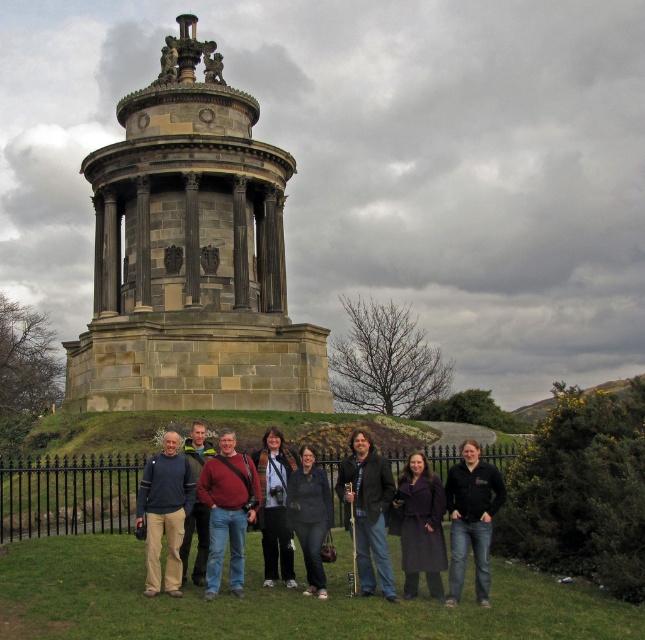
Is dark blue sweater at center taller than knitted sweater at center?

Indeed, dark blue sweater at center has a greater height compared to knitted sweater at center.

Between point (208, 536) and point (203, 468), which one is positioned behind?

The point (203, 468) is more distant.

The height and width of the screenshot is (640, 645). I want to click on dark blue sweater at center, so click(263, 502).

Is brown stone tower at center to the left of dark blue sweater at center from the viewer's perspective?

Indeed, brown stone tower at center is positioned on the left side of dark blue sweater at center.

Can you confirm if brown stone tower at center is positioned above dark blue sweater at center?

Yes.

Which is behind, point (208, 326) or point (179, 564)?

The point (208, 326) is more distant.

You are a GUI agent. You are given a task and a screenshot of the screen. Output one action in this format:
    pyautogui.click(x=<x>, y=<y>)
    Task: Click on the brown stone tower at center
    Image resolution: width=645 pixels, height=640 pixels.
    Given the screenshot: What is the action you would take?
    pyautogui.click(x=192, y=256)

Is dark gray jacket at center below dark brown leather coat at center?

No.

Who is higher up, dark gray jacket at center or dark brown leather coat at center?

dark gray jacket at center is higher up.

Does point (381, 488) come closer to viewer compared to point (428, 515)?

No, (381, 488) is further to viewer.

Find the location of a particular element. The width and height of the screenshot is (645, 640). dark gray jacket at center is located at coordinates (368, 509).